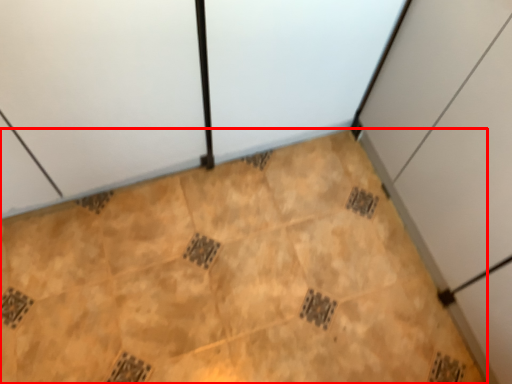
Question: From the image's perspective, considering the relative positions of ceramic tile (annotated by the red box) and cabinetry in the image provided, where is ceramic tile (annotated by the red box) located with respect to the staircase?

Choices:
 (A) above
 (B) below

Answer: (B)